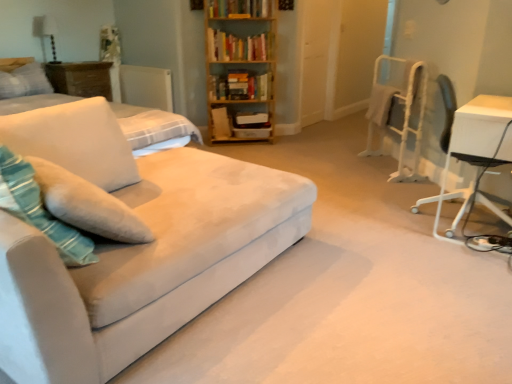
Locate an element on the screen. This screenshot has height=384, width=512. vacant area situated to the left side of white glossy table at right, which is counted as the second table, starting from the back is located at coordinates (391, 230).